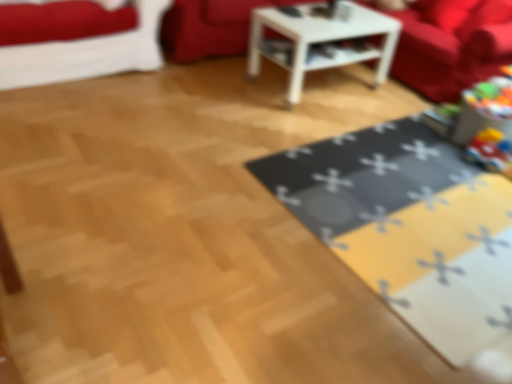
Question: From the image's perspective, is velvet red couch at upper right, placed as the first couch when sorted from right to left, beneath yellow fabric mat at lower right?

Choices:
 (A) yes
 (B) no

Answer: (B)

Question: Is velvet red couch at upper right, placed as the first couch when sorted from right to left, located outside yellow fabric mat at lower right?

Choices:
 (A) no
 (B) yes

Answer: (B)

Question: Is velvet red couch at upper right, placed as the first couch when sorted from right to left, further to the viewer compared to yellow fabric mat at lower right?

Choices:
 (A) yes
 (B) no

Answer: (A)

Question: Considering the relative positions of velvet red couch at upper right, the second couch viewed from the left, and yellow fabric mat at lower right in the image provided, is velvet red couch at upper right, the second couch viewed from the left, in front of yellow fabric mat at lower right?

Choices:
 (A) no
 (B) yes

Answer: (A)

Question: Is velvet red couch at upper right, the second couch viewed from the left, thinner than yellow fabric mat at lower right?

Choices:
 (A) no
 (B) yes

Answer: (A)

Question: In terms of height, does white glossy table at center look taller or shorter compared to velvet red couch at upper left?

Choices:
 (A) short
 (B) tall

Answer: (A)

Question: From the image's perspective, is white glossy table at center above or below velvet red couch at upper left?

Choices:
 (A) below
 (B) above

Answer: (A)

Question: Choose the correct answer: Is white glossy table at center inside velvet red couch at upper left or outside it?

Choices:
 (A) inside
 (B) outside

Answer: (B)

Question: Considering the positions of white glossy table at center and velvet red couch at upper left in the image, is white glossy table at center wider or thinner than velvet red couch at upper left?

Choices:
 (A) wide
 (B) thin

Answer: (A)

Question: From a real-world perspective, is velvet red couch at upper center, which ranks as the 1th couch in left-to-right order, above or below yellow fabric mat at lower right?

Choices:
 (A) above
 (B) below

Answer: (A)

Question: Is velvet red couch at upper center, which appears as the second couch when viewed from the right, spatially inside yellow fabric mat at lower right, or outside of it?

Choices:
 (A) inside
 (B) outside

Answer: (B)

Question: From their relative heights in the image, would you say velvet red couch at upper center, which appears as the second couch when viewed from the right, is taller or shorter than yellow fabric mat at lower right?

Choices:
 (A) short
 (B) tall

Answer: (B)

Question: Is velvet red couch at upper center, which ranks as the 1th couch in left-to-right order, in front of or behind yellow fabric mat at lower right in the image?

Choices:
 (A) behind
 (B) front

Answer: (A)

Question: From a real-world perspective, relative to white glossy table at center, is velvet red couch at upper center, which appears as the second couch when viewed from the right, vertically above or below?

Choices:
 (A) below
 (B) above

Answer: (A)

Question: Is point (206, 3) positioned closer to the camera than point (373, 24)?

Choices:
 (A) farther
 (B) closer

Answer: (A)